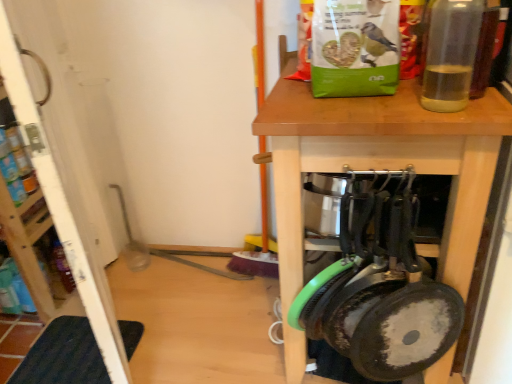
Locate an element on the screen. The image size is (512, 384). free point above dark blue rubber mat at lower left (from a real-world perspective) is located at coordinates (69, 357).